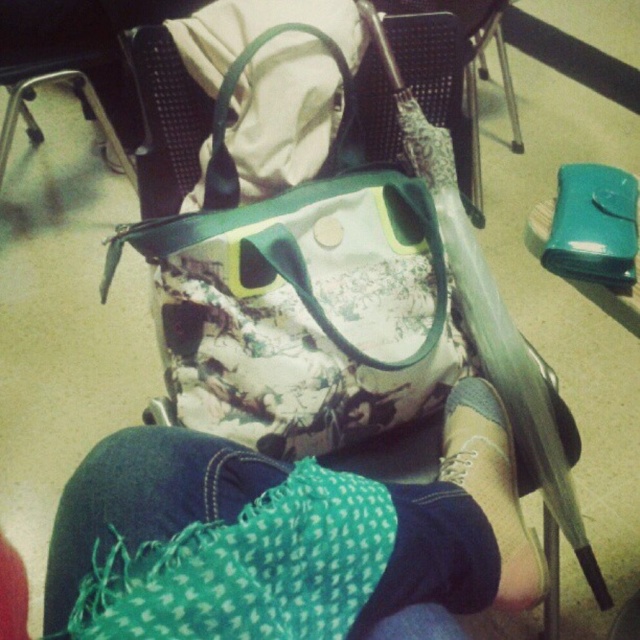
Who is higher up, green knitted scarf at lower center or suede gray shoe at lower center?

suede gray shoe at lower center

Which of these two, green knitted scarf at lower center or suede gray shoe at lower center, stands shorter?

green knitted scarf at lower center is shorter.

Image resolution: width=640 pixels, height=640 pixels. Find the location of `green knitted scarf at lower center`. green knitted scarf at lower center is located at coordinates (282, 536).